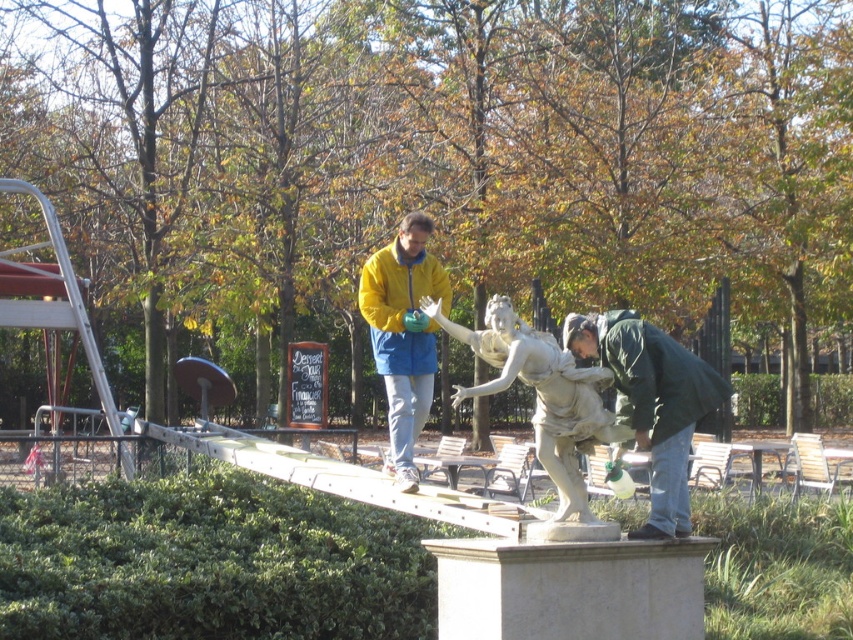
Can you confirm if green matte jacket at lower right is smaller than yellow matte jacket at center?

No.

Is point (612, 472) positioned in front of point (432, 323)?

Yes, it is in front of point (432, 323).

Where is `green matte jacket at lower right`? The image size is (853, 640). green matte jacket at lower right is located at coordinates (653, 403).

Does green matte jacket at lower right have a smaller size compared to white marble statue at center?

Actually, green matte jacket at lower right might be larger than white marble statue at center.

Describe the element at coordinates (653, 403) in the screenshot. I see `green matte jacket at lower right` at that location.

The image size is (853, 640). Identify the location of green matte jacket at lower right. (653, 403).

At what (x,y) coordinates should I click in order to perform the action: click on green matte jacket at lower right. Please return your answer as a coordinate pair (x, y). This screenshot has width=853, height=640. Looking at the image, I should click on (653, 403).

Is point (511, 337) less distant than point (368, 257)?

Yes, it is.

Between point (572, 496) and point (372, 280), which one is positioned behind?

The point (372, 280) is behind.

Identify the location of white marble statue at center. This screenshot has width=853, height=640. (541, 394).